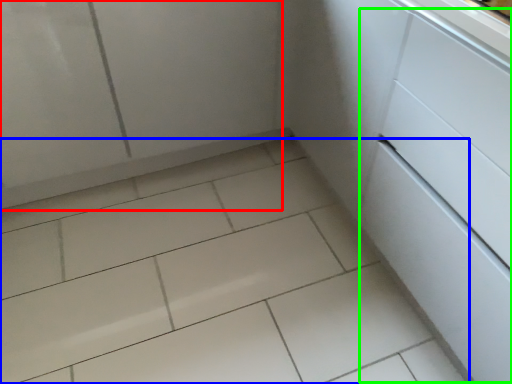
Question: Based on their relative distances, which object is farther from screen door (highlighted by a red box)? Choose from ceramic tile (highlighted by a blue box) and drawer (highlighted by a green box).

Choices:
 (A) ceramic tile
 (B) drawer

Answer: (B)